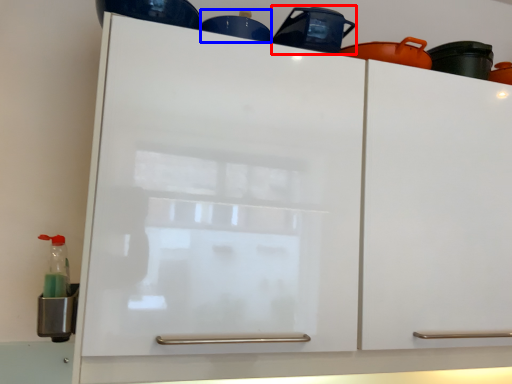
Question: Which point is closer to the camera, appliance (highlighted by a red box) or appliance (highlighted by a blue box)?

Choices:
 (A) appliance
 (B) appliance

Answer: (A)